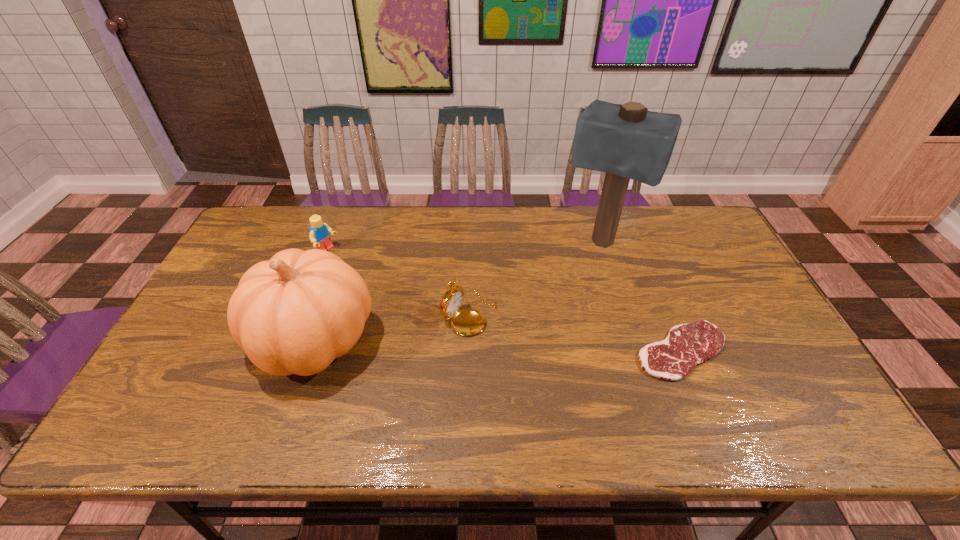
Find the location of a particular element. The height and width of the screenshot is (540, 960). free space between the second tallest object and the third object from left to right is located at coordinates (392, 327).

Locate an element on the screen. vacant space that's between the shortest object and the Lego is located at coordinates (505, 301).

You are a GUI agent. You are given a task and a screenshot of the screen. Output one action in this format:
    pyautogui.click(x=<x>, y=<y>)
    Task: Click on the free spot between the tallest object and the shortest object
    This screenshot has width=960, height=540.
    Given the screenshot: What is the action you would take?
    pyautogui.click(x=641, y=297)

This screenshot has height=540, width=960. I want to click on empty space that is in between the steak and the Lego, so click(x=505, y=301).

The width and height of the screenshot is (960, 540). Identify the location of free space between the mallet and the Lego. (464, 247).

At what (x,y) coordinates should I click in order to perform the action: click on vacant space that's between the pocket watch and the Lego. Please return your answer as a coordinate pair (x, y). The width and height of the screenshot is (960, 540). Looking at the image, I should click on (398, 282).

What are the coordinates of `the second closest object to the third object from left to right` in the screenshot? It's located at 627,141.

Locate which object ranks third in proximity to the mallet. Please provide its 2D coordinates. Your answer should be formatted as a tuple, i.e. [(x, y)], where the tuple contains the x and y coordinates of a point satisfying the conditions above.

[(293, 314)]

You are a GUI agent. You are given a task and a screenshot of the screen. Output one action in this format:
    pyautogui.click(x=<x>, y=<y>)
    Task: Click on the vacant space that satisfies the following two spatial constraints: 1. on the back side of the tallest object; 2. on the left side of the second tallest object
    The height and width of the screenshot is (540, 960).
    Given the screenshot: What is the action you would take?
    pyautogui.click(x=347, y=243)

Locate an element on the screen. This screenshot has height=540, width=960. blank space that satisfies the following two spatial constraints: 1. on the front side of the Lego; 2. on the left side of the steak is located at coordinates (290, 350).